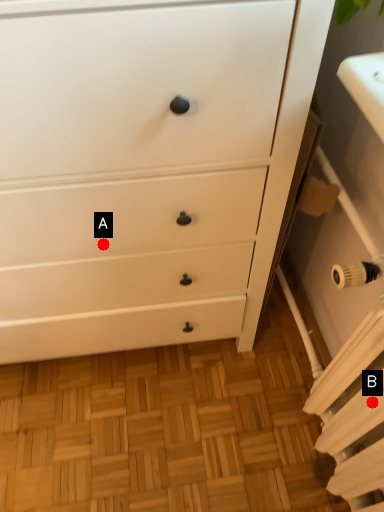
Question: Two points are circled on the image, labeled by A and B beside each circle. Which point is further to the camera?

Choices:
 (A) A is further
 (B) B is further

Answer: (A)